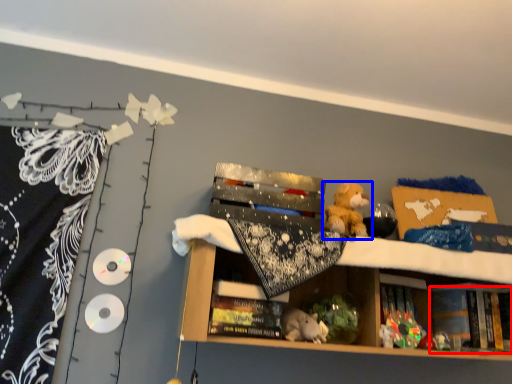
Question: Among these objects, which one is farthest to the camera, book (highlighted by a red box) or toy (highlighted by a blue box)?

Choices:
 (A) book
 (B) toy

Answer: (A)